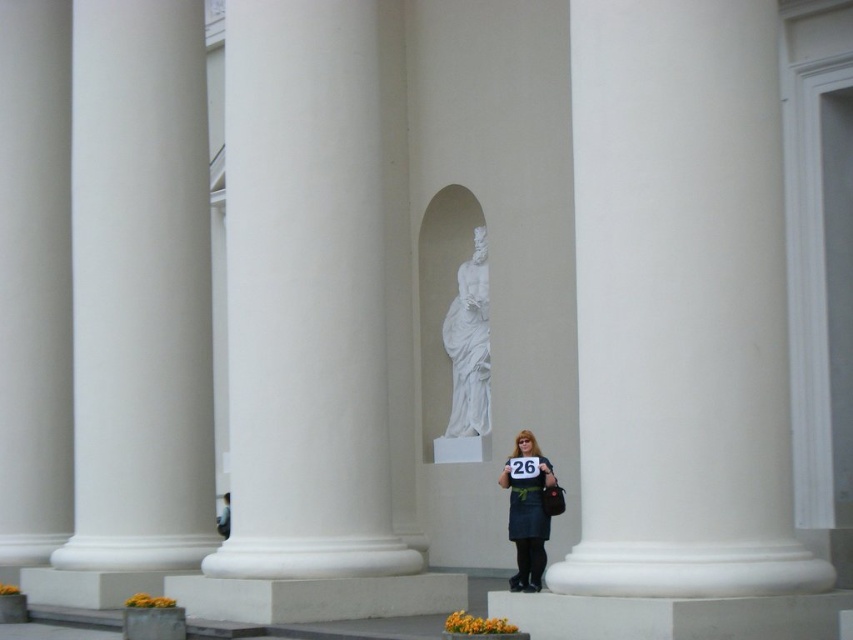
Question: Is white smooth column at left to the right of matte black dress at center from the viewer's perspective?

Choices:
 (A) yes
 (B) no

Answer: (B)

Question: Does white smooth pillar at right have a smaller size compared to matte black dress at center?

Choices:
 (A) no
 (B) yes

Answer: (A)

Question: Which is farther from the matte black dress at center?

Choices:
 (A) white smooth column at center
 (B) white marble statue at center

Answer: (B)

Question: Which of the following is the closest to the observer?

Choices:
 (A) (486, 291)
 (B) (714, 40)

Answer: (B)

Question: Among these points, which one is nearest to the camera?

Choices:
 (A) (238, 227)
 (B) (646, 54)
 (C) (199, 317)
 (D) (469, 384)

Answer: (B)

Question: Is white smooth pillar at right positioned before white smooth column at left?

Choices:
 (A) no
 (B) yes

Answer: (B)